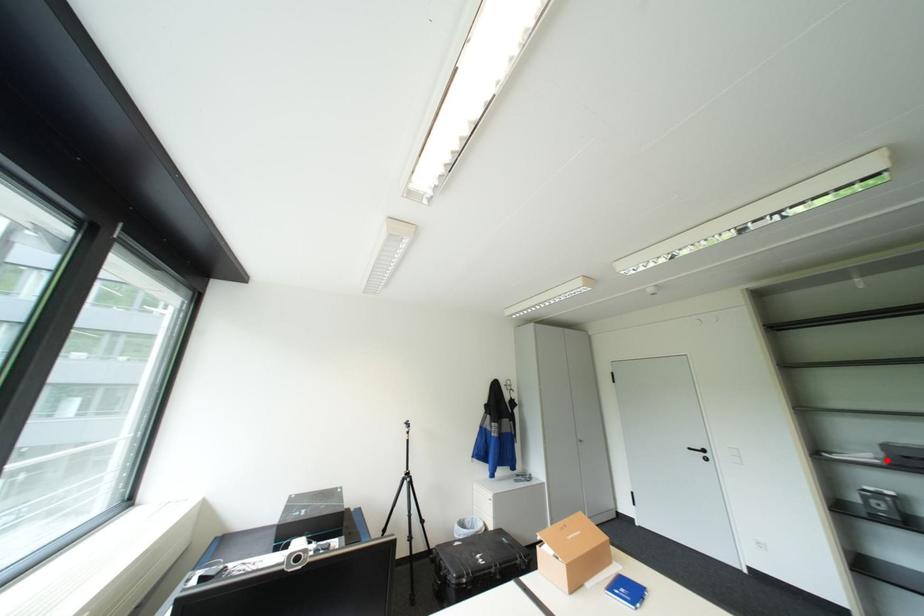
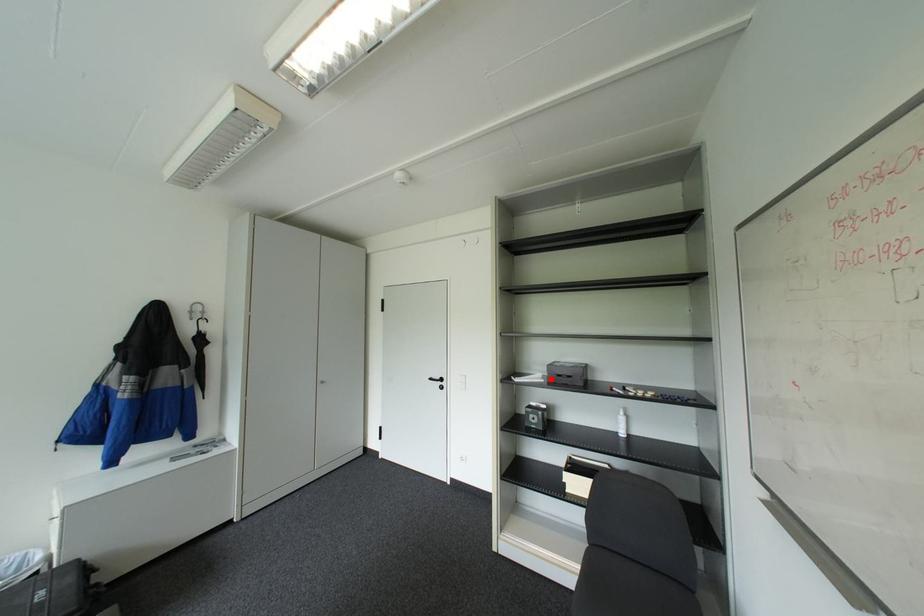
I am providing you with two images of the same scene from different viewpoints. A red point is marked on the first image and another point is marked on the second image. Do the highlighted points in image1 and image2 indicate the same real-world spot?

Yes